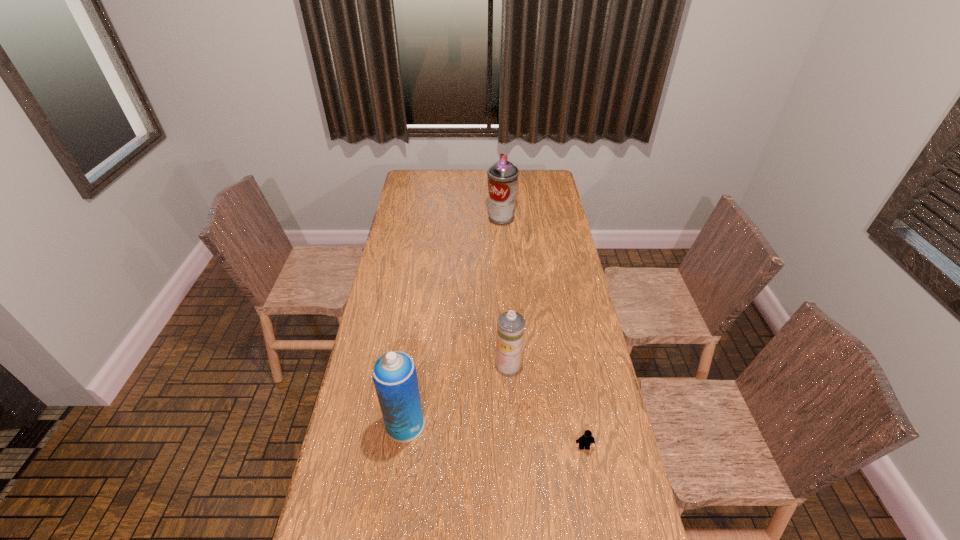
Where is `vacant space located on the face of the nearest object`? vacant space located on the face of the nearest object is located at coordinates (599, 527).

The height and width of the screenshot is (540, 960). What are the coordinates of `object located in the left edge section of the desktop` in the screenshot? It's located at (394, 374).

Identify the location of object that is positioned at the right edge. Image resolution: width=960 pixels, height=540 pixels. (586, 439).

The height and width of the screenshot is (540, 960). In order to click on vacant space at the left edge in this screenshot , I will do `click(336, 531)`.

The width and height of the screenshot is (960, 540). In the image, there is a desktop. What are the coordinates of `vacant space at the right edge` in the screenshot? It's located at (551, 231).

Locate an element on the screen. This screenshot has width=960, height=540. free space between the nearest aerosol can and the second farthest object is located at coordinates (457, 394).

Find the location of `vacant area that lies between the leftmost object and the Lego`. vacant area that lies between the leftmost object and the Lego is located at coordinates (494, 436).

Where is `free spot between the nearest object and the second farthest object`? This screenshot has width=960, height=540. free spot between the nearest object and the second farthest object is located at coordinates (546, 406).

Locate an element on the screen. Image resolution: width=960 pixels, height=540 pixels. free space between the rightmost object and the second nearest object is located at coordinates (494, 436).

Where is `free space between the farthest object and the second farthest aerosol can`? free space between the farthest object and the second farthest aerosol can is located at coordinates (505, 291).